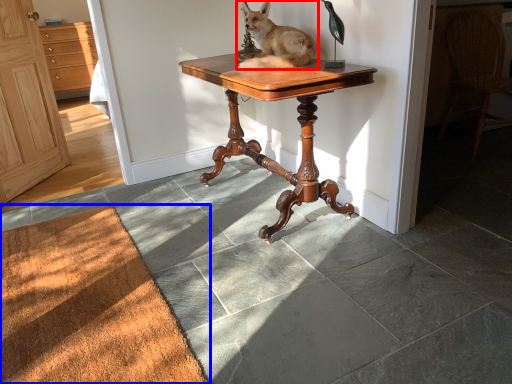
Question: Which of the following is the closest to the observer, dog (highlighted by a red box) or doormat (highlighted by a blue box)?

Choices:
 (A) dog
 (B) doormat

Answer: (B)